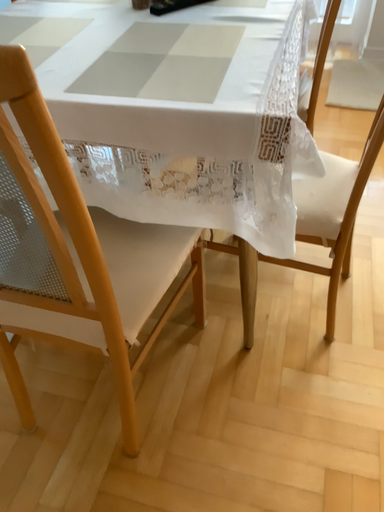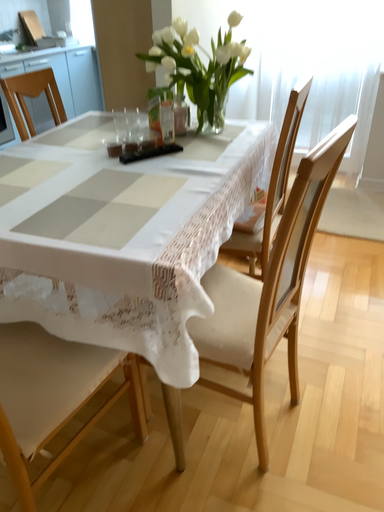
Question: How did the camera likely rotate when shooting the video?

Choices:
 (A) rotated upward
 (B) rotated downward

Answer: (A)